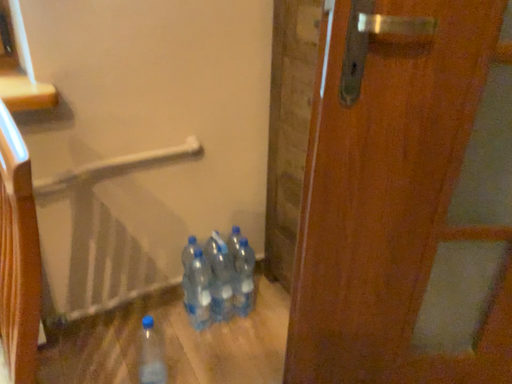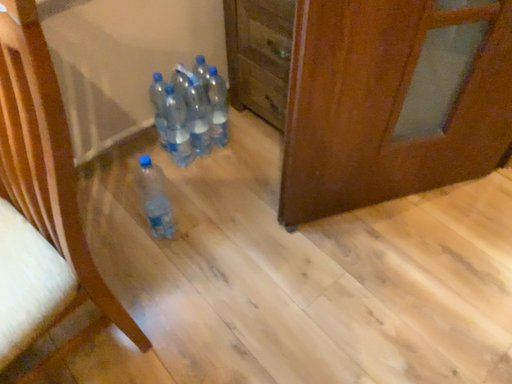
Question: How did the camera likely rotate when shooting the video?

Choices:
 (A) rotated left
 (B) rotated right

Answer: (B)